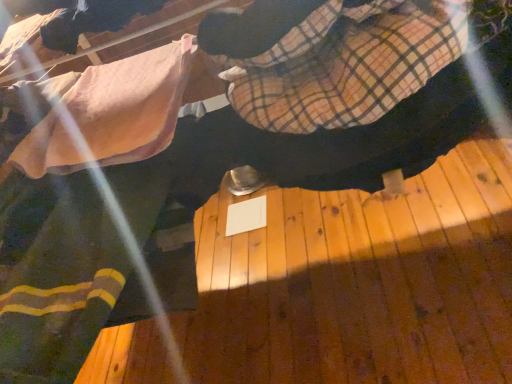
Describe the element at coordinates (347, 64) in the screenshot. I see `plaid fabric at upper center` at that location.

At what (x,y) coordinates should I click in order to perform the action: click on plaid fabric at upper center. Please return your answer as a coordinate pair (x, y). The width and height of the screenshot is (512, 384). Looking at the image, I should click on (347, 64).

Find the location of a particular element. Image resolution: width=512 pixels, height=384 pixels. plaid fabric at upper center is located at coordinates (347, 64).